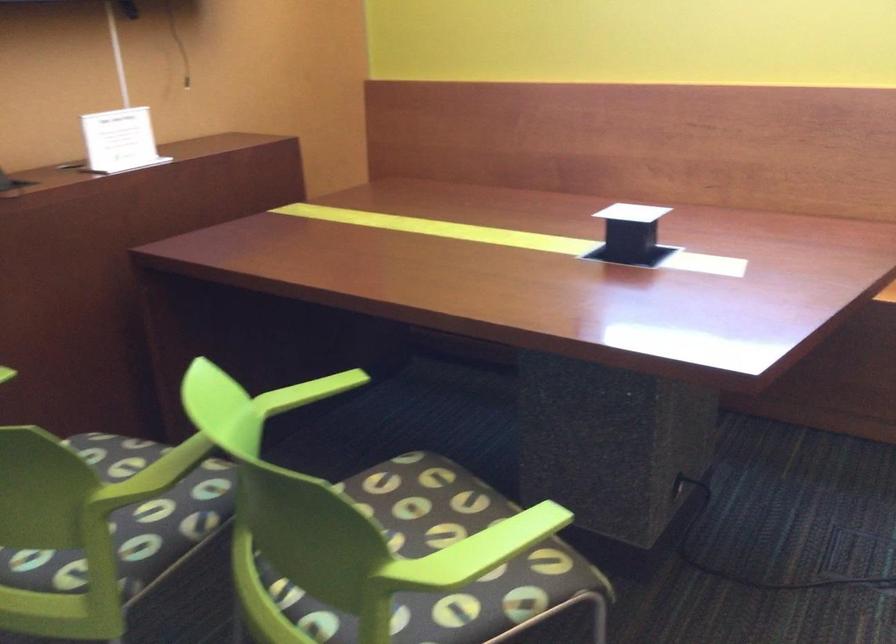
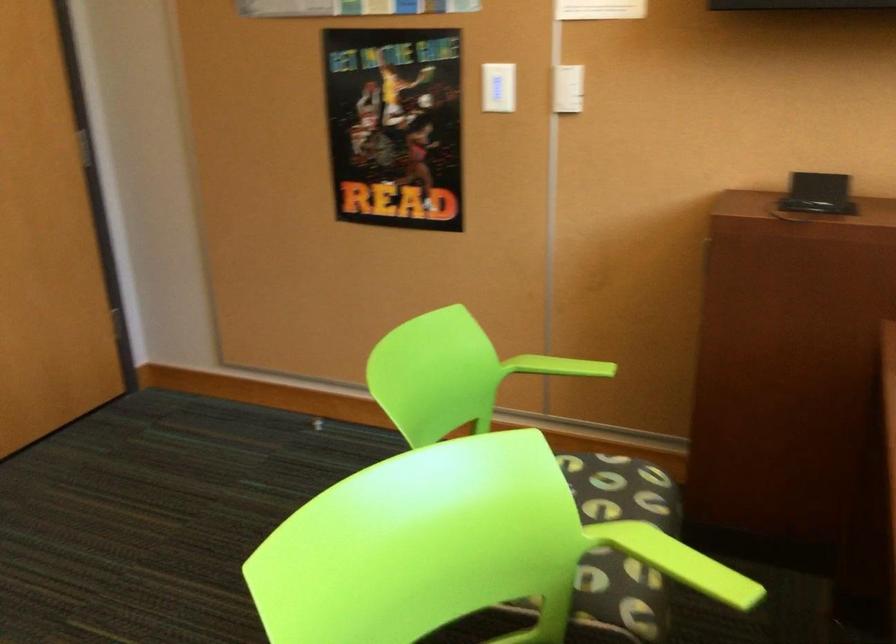
In the second image, find the point that corresponds to [316,390] in the first image.

(685, 564)